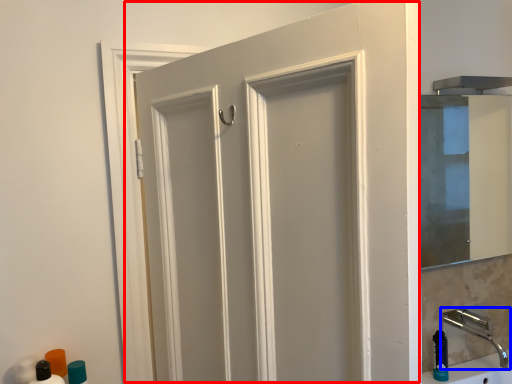
Question: Which of the following is the closest to the observer, door (highlighted by a red box) or tap (highlighted by a blue box)?

Choices:
 (A) door
 (B) tap

Answer: (A)